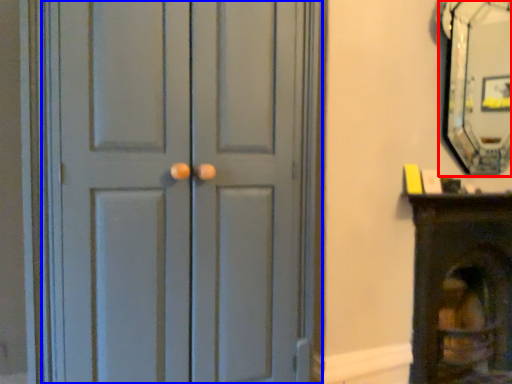
Question: Which object is closer to the camera taking this photo, fireplace (highlighted by a red box) or door (highlighted by a blue box)?

Choices:
 (A) fireplace
 (B) door

Answer: (B)